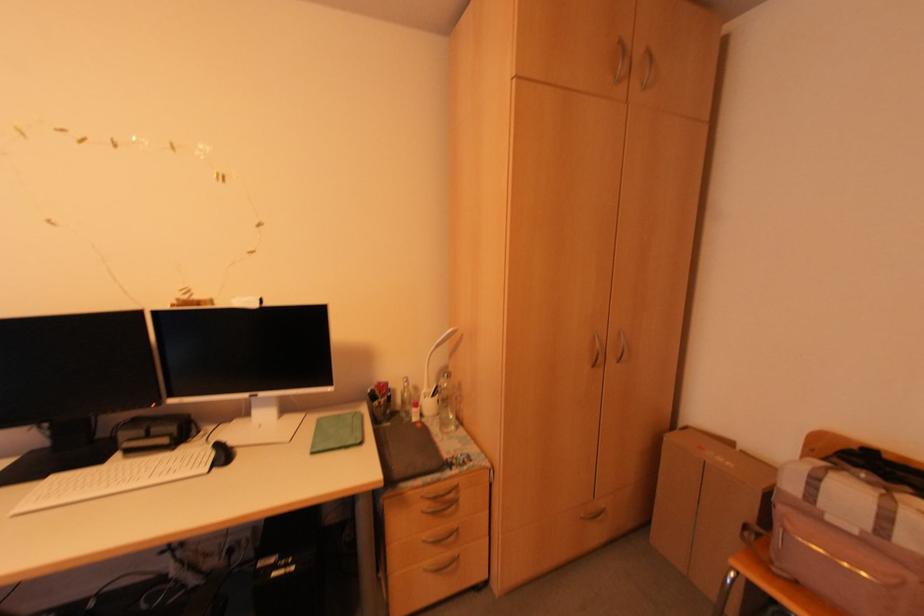
Where would you lift the white desk lamp? Please return your answer as a coordinate pair (x, y).

(432, 377)